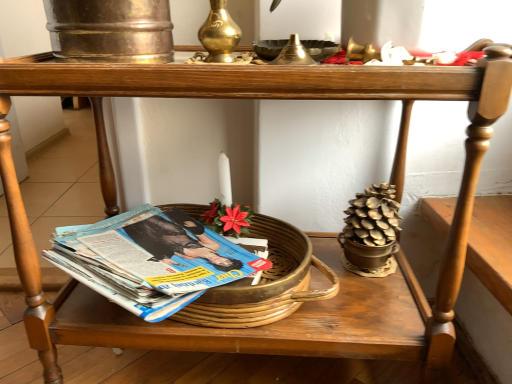
This screenshot has height=384, width=512. Identify the location of vacant area situated to the left side of brass candle holder at upper center, positioned as the 2th candle holder in right-to-left order. (96, 56).